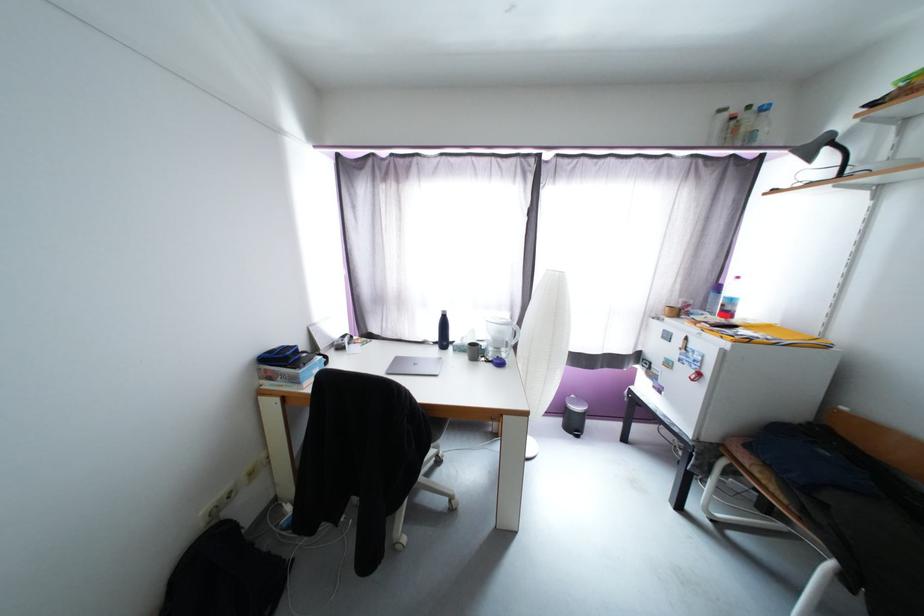
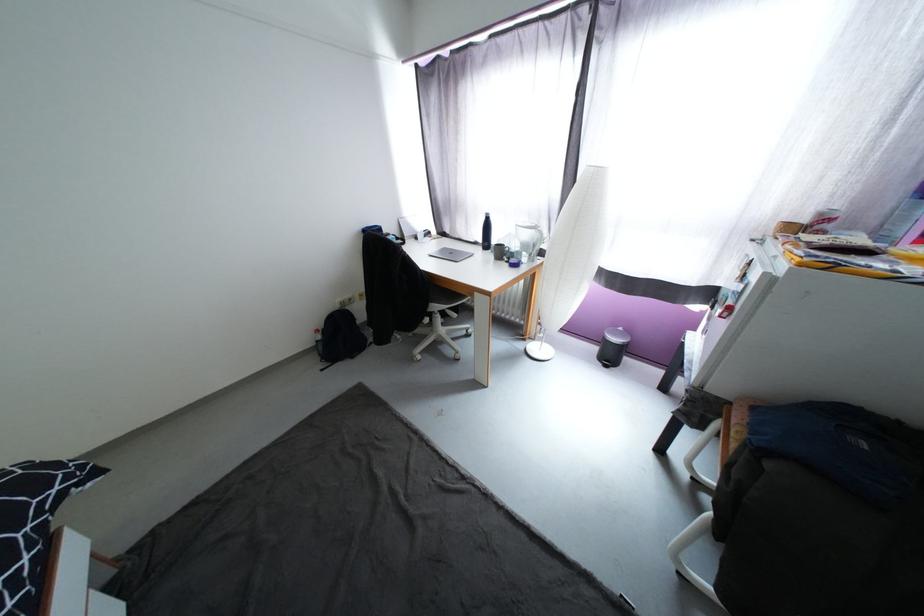
Based on the continuous images, in which direction is the camera rotating?

The camera's rotation is toward left-down.